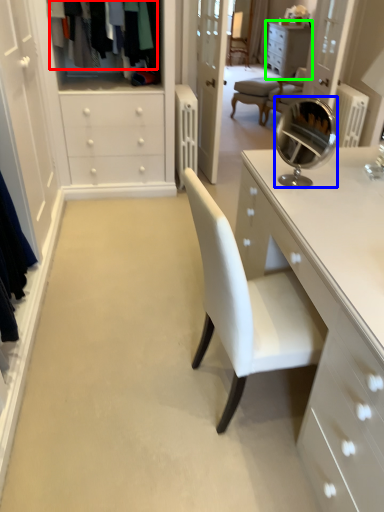
Question: Estimate the real-world distances between objects in this image. Which object is closer to clothing (highlighted by a red box), mirror (highlighted by a blue box) or cabinetry (highlighted by a green box)?

Choices:
 (A) mirror
 (B) cabinetry

Answer: (A)